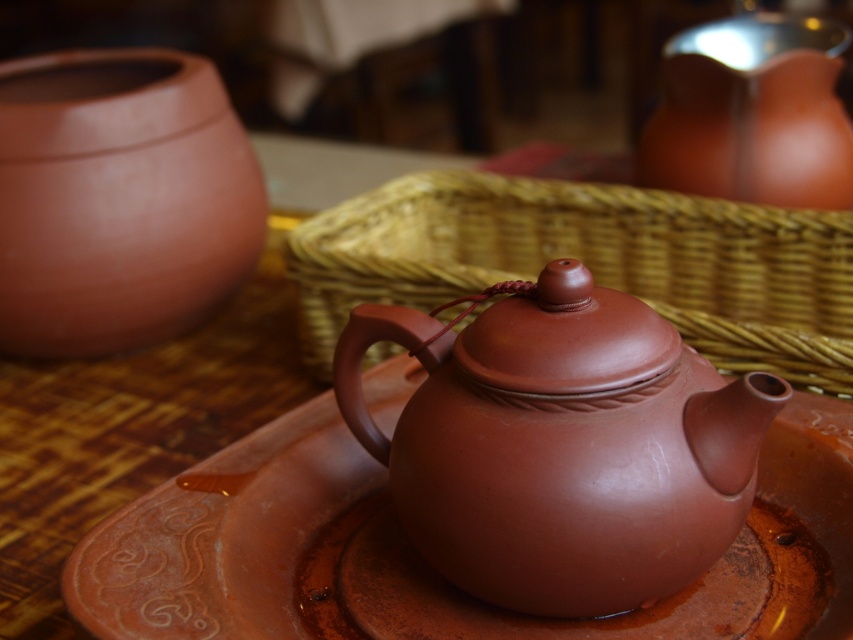
This screenshot has width=853, height=640. Find the location of `matte clay teapot at center`. matte clay teapot at center is located at coordinates (561, 445).

Between point (461, 557) and point (354, 272), which one is positioned in front?

Point (461, 557)

Where is `matte clay teapot at center`? The image size is (853, 640). matte clay teapot at center is located at coordinates (561, 445).

The image size is (853, 640). I want to click on matte clay teapot at center, so click(x=561, y=445).

Find the location of a particular element. The image size is (853, 640). matte clay teapot at center is located at coordinates (561, 445).

Who is more forward, (722,420) or (140,337)?

Point (722,420) is more forward.

Is point (509, 422) positioned behind point (21, 252)?

No, it is in front of (21, 252).

Where is `matte clay teapot at center`? Image resolution: width=853 pixels, height=640 pixels. matte clay teapot at center is located at coordinates pyautogui.click(x=561, y=445).

Does brown glossy plate at center appear under matte wicker basket at center?

Yes, brown glossy plate at center is below matte wicker basket at center.

Is point (729, 593) farther from viewer compared to point (714, 356)?

No, (729, 593) is in front of (714, 356).

You are a GUI agent. You are given a task and a screenshot of the screen. Output one action in this format:
    pyautogui.click(x=<x>, y=<y>)
    Task: Click on the brown glossy plate at center
    
    Given the screenshot: What is the action you would take?
    pyautogui.click(x=421, y=561)